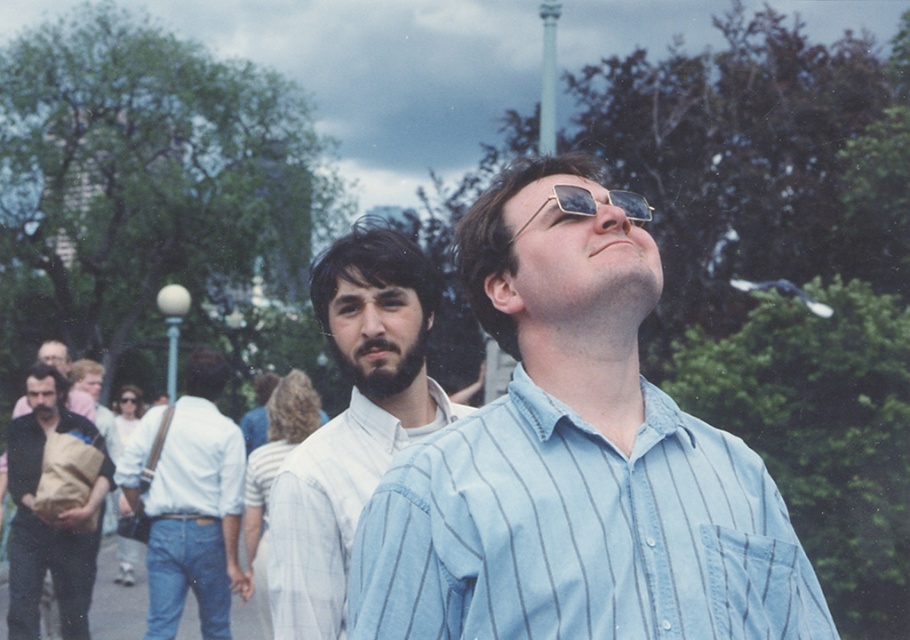
Who is taller, white shirt at center or brown paper bag at left?

brown paper bag at left is taller.

Describe the element at coordinates (352, 420) in the screenshot. I see `white shirt at center` at that location.

Where is `white shirt at center`? The image size is (910, 640). white shirt at center is located at coordinates (352, 420).

Is white cotton shirt at center taller than metallic reflective sunglasses at upper center?

Indeed, white cotton shirt at center has a greater height compared to metallic reflective sunglasses at upper center.

Does white cotton shirt at center lie behind metallic reflective sunglasses at upper center?

Yes, it is.

Does point (180, 428) lie behind point (637, 211)?

Yes, point (180, 428) is behind point (637, 211).

Where is `white cotton shirt at center`? The width and height of the screenshot is (910, 640). white cotton shirt at center is located at coordinates (190, 502).

Does white shirt at center have a greater width compared to dark brown leather jacket at lower left?

No, white shirt at center is not wider than dark brown leather jacket at lower left.

Between white shirt at center and dark brown leather jacket at lower left, which one has more height?

white shirt at center

Is point (349, 465) positioned behind point (41, 349)?

That is False.

The image size is (910, 640). In order to click on white shirt at center in this screenshot , I will do `click(352, 420)`.